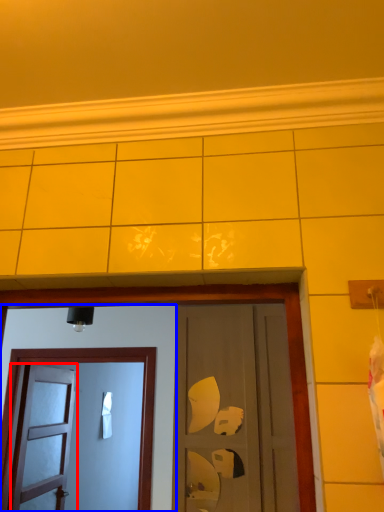
Question: Which object appears closest to the camera in this image, door (highlighted by a red box) or door (highlighted by a blue box)?

Choices:
 (A) door
 (B) door

Answer: (B)